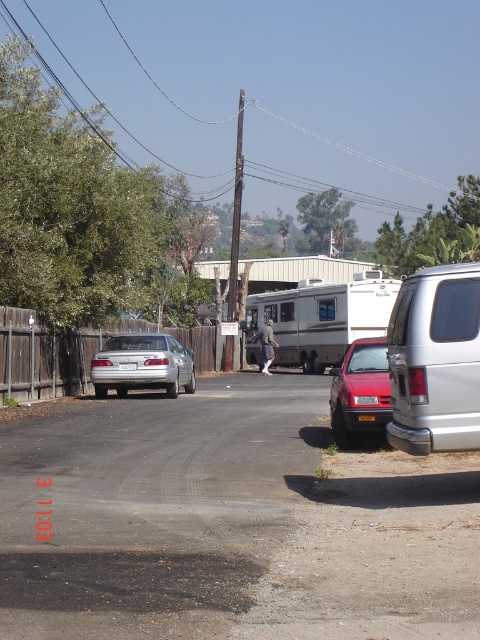
Is the position of silver metallic camper at center more distant than that of metallic red car at right?

Yes, silver metallic camper at center is behind metallic red car at right.

Between silver metallic camper at center and metallic red car at right, which one has more height?

Standing taller between the two is silver metallic camper at center.

Find the location of `silver metallic camper at center`. silver metallic camper at center is located at coordinates (320, 320).

The width and height of the screenshot is (480, 640). Find the location of `silver metallic camper at center`. silver metallic camper at center is located at coordinates (320, 320).

Is the position of silver metallic van at right more distant than that of white plastic license plate at center?

No, it is in front of white plastic license plate at center.

Between point (423, 307) and point (132, 364), which one is positioned in front?

Point (423, 307)

Is point (394, 355) behind point (123, 364)?

That is False.

This screenshot has width=480, height=640. I want to click on silver metallic van at right, so coord(435,360).

Does point (458, 292) lie in front of point (139, 372)?

Yes, point (458, 292) is closer to viewer.

Who is more forward, (470, 419) or (96, 372)?

Point (470, 419) is more forward.

Which is behind, point (420, 362) or point (156, 384)?

Point (156, 384)

Locate an element on the screen. This screenshot has width=480, height=640. silver metallic van at right is located at coordinates (435, 360).